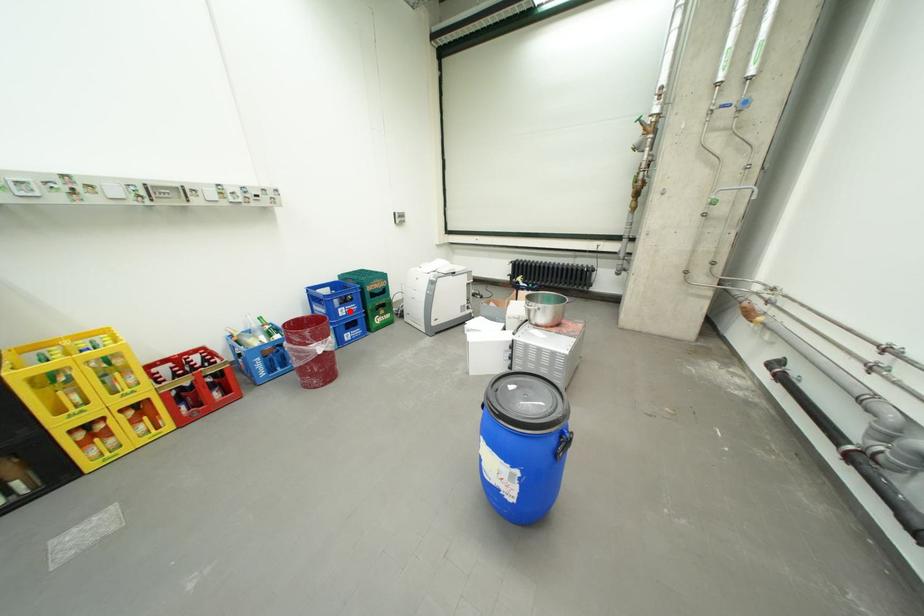
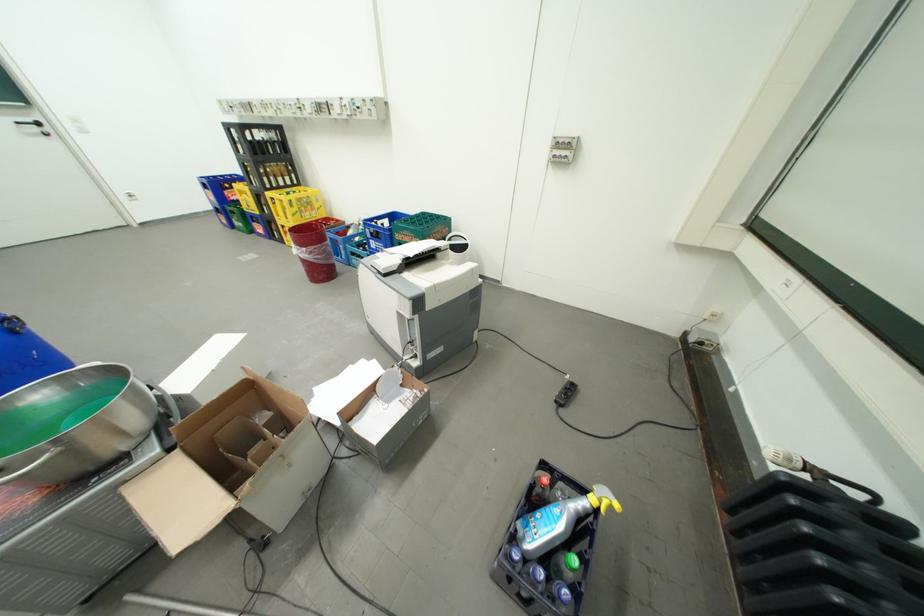
Find the pixel in the second image that matches the highlighted location in the first image.

(381, 241)